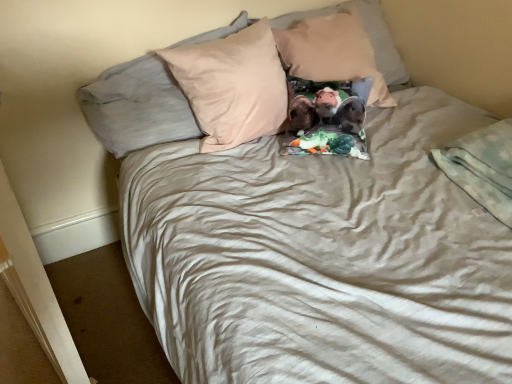
Question: From a real-world perspective, is beige cotton pillow at center, which is the second pillow from left to right, located beneath beige fabric pillow at upper center, placed as the third pillow when sorted from right to left?

Choices:
 (A) yes
 (B) no

Answer: (B)

Question: Considering the relative sizes of beige cotton pillow at center, which is the second pillow from left to right, and beige fabric pillow at upper center, placed as the third pillow when sorted from right to left, in the image provided, is beige cotton pillow at center, which is the second pillow from left to right, smaller than beige fabric pillow at upper center, placed as the third pillow when sorted from right to left,?

Choices:
 (A) no
 (B) yes

Answer: (A)

Question: Is beige cotton pillow at center, which is the second pillow from left to right, in contact with beige fabric pillow at upper center, placed as the third pillow when sorted from right to left?

Choices:
 (A) no
 (B) yes

Answer: (B)

Question: Can you confirm if beige cotton pillow at center, which is the second pillow from left to right, is bigger than beige fabric pillow at upper center, placed as the third pillow when sorted from right to left?

Choices:
 (A) yes
 (B) no

Answer: (A)

Question: Does beige cotton pillow at center, which is the second pillow from left to right, have a lesser height compared to beige fabric pillow at upper center, the 1th pillow positioned from the left?

Choices:
 (A) yes
 (B) no

Answer: (B)

Question: Relative to beige cotton pillow at center, arranged as the second pillow when viewed from the right, is light gray soft blanket at lower right in front or behind?

Choices:
 (A) front
 (B) behind

Answer: (A)

Question: Based on their sizes in the image, would you say light gray soft blanket at lower right is bigger or smaller than beige cotton pillow at center, arranged as the second pillow when viewed from the right?

Choices:
 (A) big
 (B) small

Answer: (B)

Question: Would you say light gray soft blanket at lower right is inside or outside beige cotton pillow at center, which is the second pillow from left to right?

Choices:
 (A) inside
 (B) outside

Answer: (B)

Question: Would you say light gray soft blanket at lower right is to the left or to the right of beige cotton pillow at center, arranged as the second pillow when viewed from the right, in the picture?

Choices:
 (A) left
 (B) right

Answer: (B)

Question: Looking at their shapes, would you say beige cotton pillow at center, which is the second pillow from left to right, is wider or thinner than fluffy fabric pillow at center, which is the 1th pillow in right-to-left order?

Choices:
 (A) thin
 (B) wide

Answer: (A)

Question: From a real-world perspective, is beige cotton pillow at center, which is the second pillow from left to right, above or below fluffy fabric pillow at center, placed as the 3th pillow when sorted from left to right?

Choices:
 (A) above
 (B) below

Answer: (B)

Question: Considering the relative positions of beige cotton pillow at center, which is the second pillow from left to right, and fluffy fabric pillow at center, placed as the 3th pillow when sorted from left to right, in the image provided, is beige cotton pillow at center, which is the second pillow from left to right, to the left or to the right of fluffy fabric pillow at center, placed as the 3th pillow when sorted from left to right,?

Choices:
 (A) right
 (B) left

Answer: (B)

Question: Is point (109, 97) closer or farther from the camera than point (278, 24)?

Choices:
 (A) farther
 (B) closer

Answer: (B)

Question: Looking at the image, does fluffy fabric pillow at center, placed as the 3th pillow when sorted from left to right, seem bigger or smaller compared to beige cotton pillow at center, arranged as the second pillow when viewed from the right?

Choices:
 (A) small
 (B) big

Answer: (A)

Question: Choose the correct answer: Is fluffy fabric pillow at center, which is the 1th pillow in right-to-left order, inside beige cotton pillow at center, arranged as the second pillow when viewed from the right, or outside it?

Choices:
 (A) inside
 (B) outside

Answer: (B)